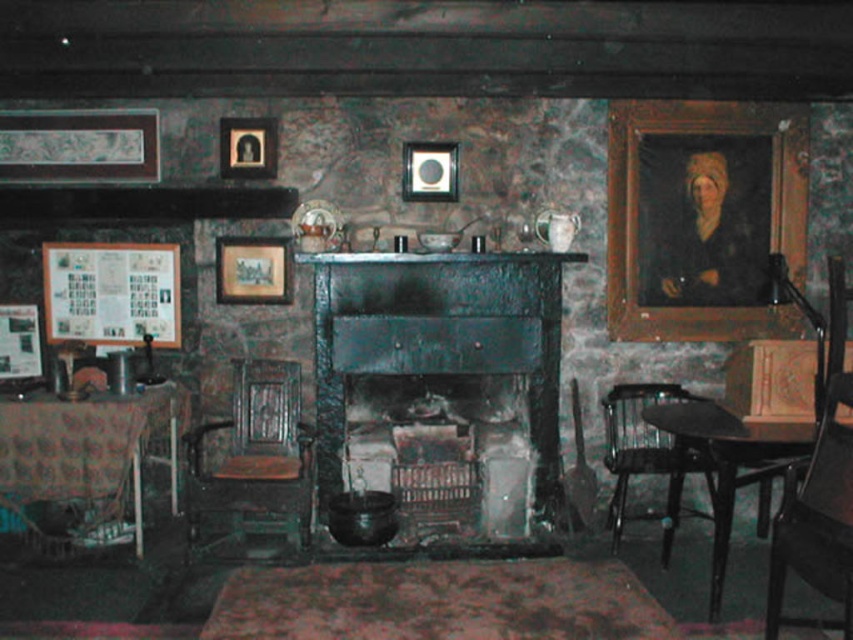
Question: Where is black wood armchair at lower right located in relation to matte paper picture frame at left in the image?

Choices:
 (A) right
 (B) left

Answer: (A)

Question: Which object appears closest to the camera in this image?

Choices:
 (A) black glossy table at lower right
 (B) wooden polished rocking chair at center-left
 (C) wooden portrait at right
 (D) wooden chair at right

Answer: (D)

Question: Estimate the real-world distances between objects in this image. Which object is closer to the black glossy table at lower right?

Choices:
 (A) wooden polished rocking chair at center-left
 (B) wooden framed picture at upper left
 (C) dark wood fireplace at center
 (D) wooden frame at upper left

Answer: (C)

Question: Is wooden polished rocking chair at center-left to the right of wooden framed picture at upper left from the viewer's perspective?

Choices:
 (A) no
 (B) yes

Answer: (B)

Question: Which point is farther to the camera?

Choices:
 (A) wooden frame at upper left
 (B) wooden portrait at right

Answer: (B)

Question: Does patterned fabric table at lower left appear on the right side of wooden chair at right?

Choices:
 (A) yes
 (B) no

Answer: (B)